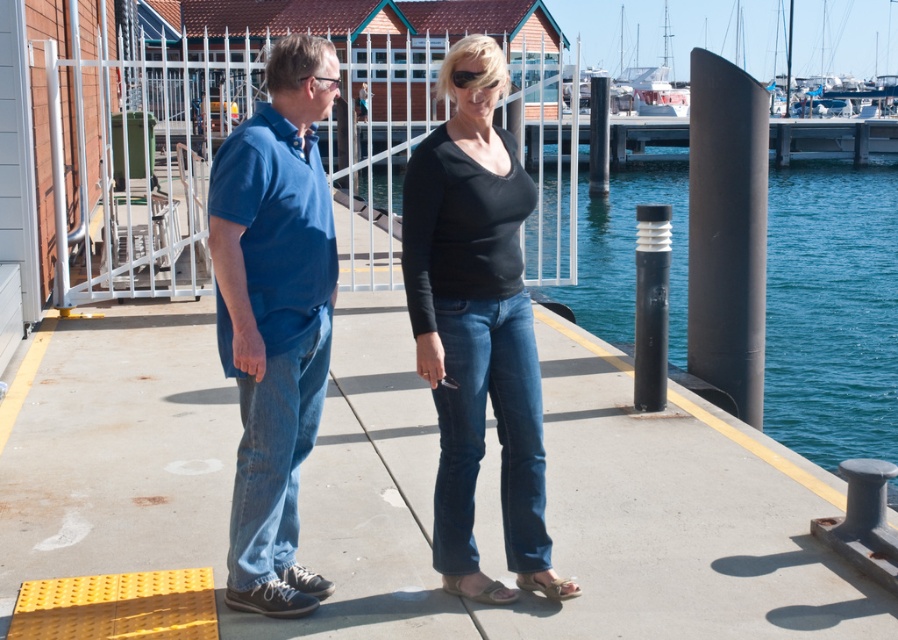
Question: Which of the following is the closest to the observer?

Choices:
 (A) blue water at center
 (B) brown leather sandal at lower center
 (C) leather sandal at lower center

Answer: (C)

Question: Which is nearer to the black matte shirt at center?

Choices:
 (A) blue water at center
 (B) blue denim jeans at center
 (C) leather sandal at lower center
 (D) blue cotton shirt at center

Answer: (B)

Question: Which of the following is the farthest from the observer?

Choices:
 (A) leather sandal at lower center
 (B) blue cotton shirt at center
 (C) blue water at center
 (D) black matte shirt at center

Answer: (C)

Question: Is blue denim jeans at center to the right of blue cotton shirt at center from the viewer's perspective?

Choices:
 (A) yes
 (B) no

Answer: (A)

Question: Can you confirm if black matte shirt at center is smaller than blue cotton shirt at center?

Choices:
 (A) no
 (B) yes

Answer: (A)

Question: Can you confirm if black matte shirt at center is bigger than brown leather sandal at lower center?

Choices:
 (A) no
 (B) yes

Answer: (B)